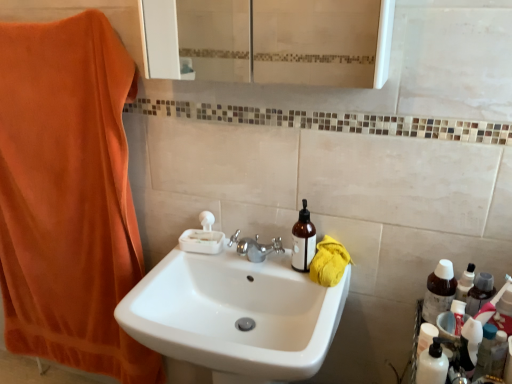
Question: Considering the relative positions of white glossy bottle at right and orange plush towel at left, which is counted as the 2th beach towel, starting from the bottom, in the image provided, is white glossy bottle at right behind orange plush towel at left, which is counted as the 2th beach towel, starting from the bottom,?

Choices:
 (A) yes
 (B) no

Answer: (B)

Question: Is white glossy bottle at right to the right of orange plush towel at left, arranged as the 1th beach towel when viewed from the left, from the viewer's perspective?

Choices:
 (A) no
 (B) yes

Answer: (B)

Question: Does white glossy bottle at right appear on the left side of orange plush towel at left, which is counted as the 2th beach towel, starting from the bottom?

Choices:
 (A) no
 (B) yes

Answer: (A)

Question: Is orange plush towel at left, which is counted as the 2th beach towel, starting from the bottom, at the back of white glossy bottle at right?

Choices:
 (A) no
 (B) yes

Answer: (A)

Question: Does white glossy bottle at right have a greater height compared to orange plush towel at left, placed as the 2th beach towel when sorted from right to left?

Choices:
 (A) yes
 (B) no

Answer: (B)

Question: Would you say white glossy bottle at right is a long distance from orange plush towel at left, placed as the 2th beach towel when sorted from right to left?

Choices:
 (A) no
 (B) yes

Answer: (B)

Question: Considering the relative sizes of white glossy sink at center and yellow cotton towel at right, acting as the first beach towel starting from the bottom, in the image provided, is white glossy sink at center smaller than yellow cotton towel at right, acting as the first beach towel starting from the bottom,?

Choices:
 (A) no
 (B) yes

Answer: (A)

Question: Considering the relative sizes of white glossy sink at center and yellow cotton towel at right, the 2th beach towel from the top, in the image provided, is white glossy sink at center thinner than yellow cotton towel at right, the 2th beach towel from the top,?

Choices:
 (A) no
 (B) yes

Answer: (A)

Question: Is white glossy sink at center taller than yellow cotton towel at right, marked as the first beach towel in a right-to-left arrangement?

Choices:
 (A) no
 (B) yes

Answer: (B)

Question: Is white glossy sink at center further to camera compared to yellow cotton towel at right, marked as the first beach towel in a right-to-left arrangement?

Choices:
 (A) yes
 (B) no

Answer: (B)

Question: Is the surface of white glossy sink at center in direct contact with yellow cotton towel at right, the 2th beach towel from the top?

Choices:
 (A) yes
 (B) no

Answer: (B)

Question: From a real-world perspective, is white glossy sink at center physically below yellow cotton towel at right, marked as the first beach towel in a right-to-left arrangement?

Choices:
 (A) no
 (B) yes

Answer: (B)

Question: Is white opaque bottle at lower right at the left side of white glossy sink at center?

Choices:
 (A) yes
 (B) no

Answer: (B)